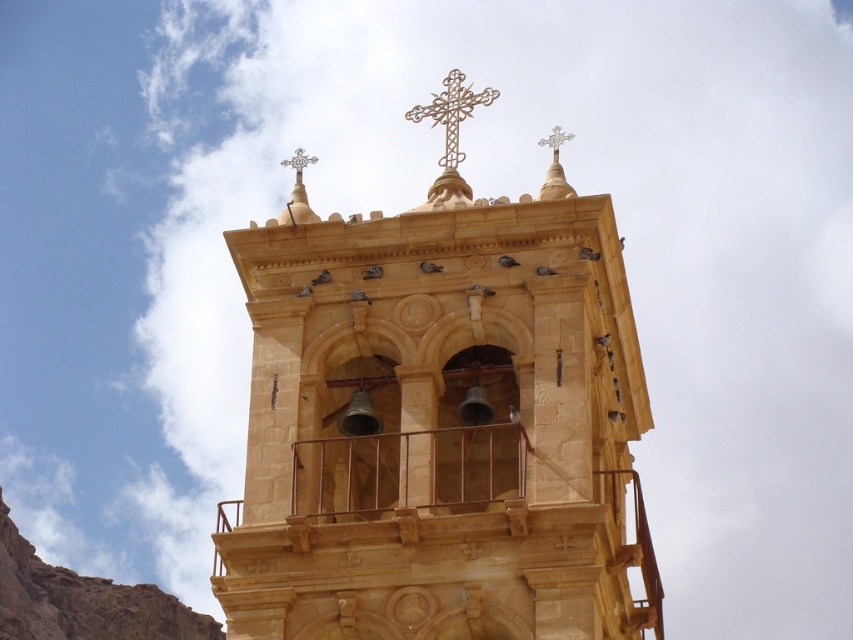
You are standing in front of the bell tower and want to take a photo of the golden stone church at center and the gold textured cross at upper center. Which object will appear larger in the photo?

The golden stone church at center will appear larger in the photo because it is closer to you than the gold textured cross at upper center.